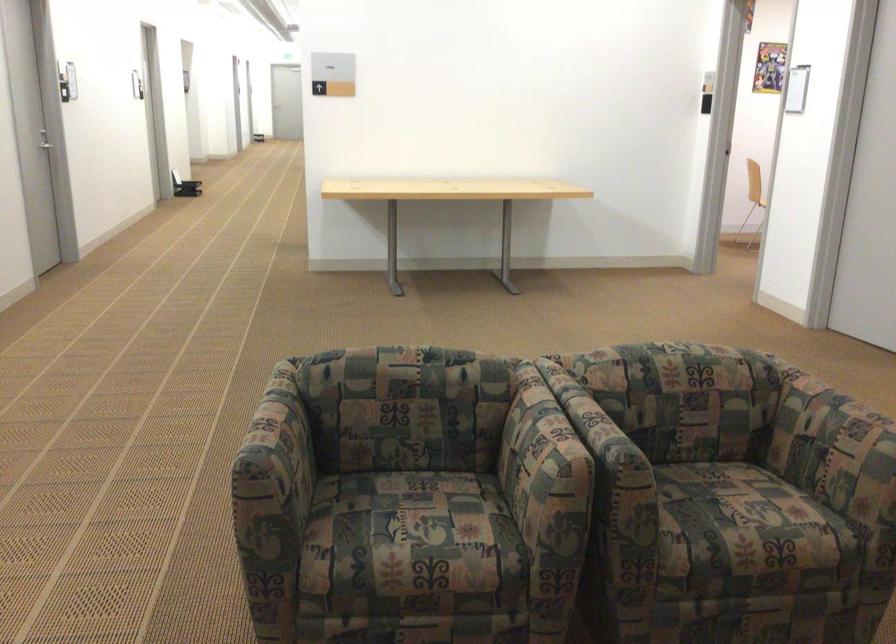
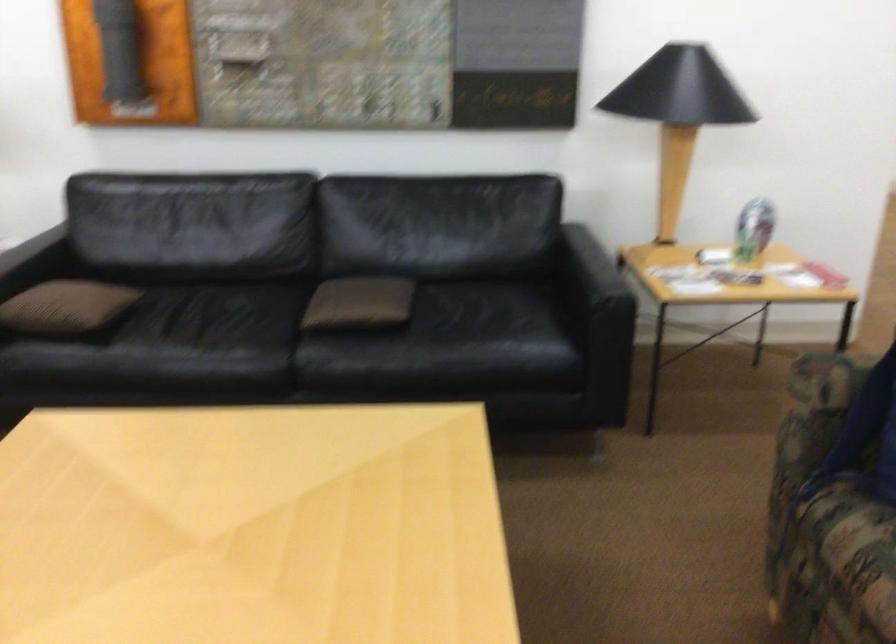
How did the camera likely rotate?

The rotation direction of the camera is right-down.